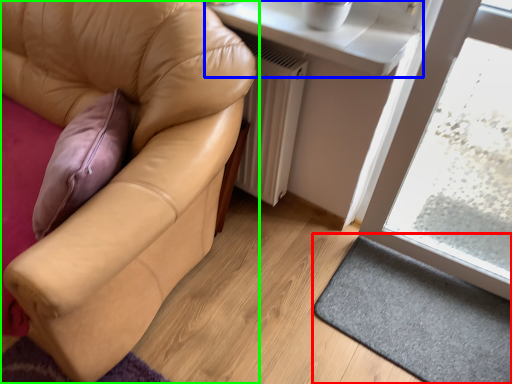
Question: Which object is positioned closest to doormat (highlighted by a red box)? Select from window sill (highlighted by a blue box) and studio couch (highlighted by a green box).

Choices:
 (A) window sill
 (B) studio couch

Answer: (B)